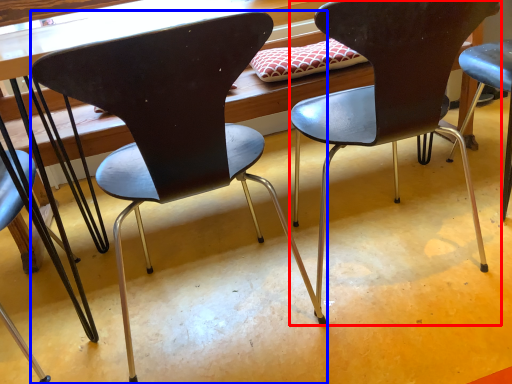
Question: Which object appears closest to the camera in this image, chair (highlighted by a red box) or chair (highlighted by a blue box)?

Choices:
 (A) chair
 (B) chair

Answer: (B)